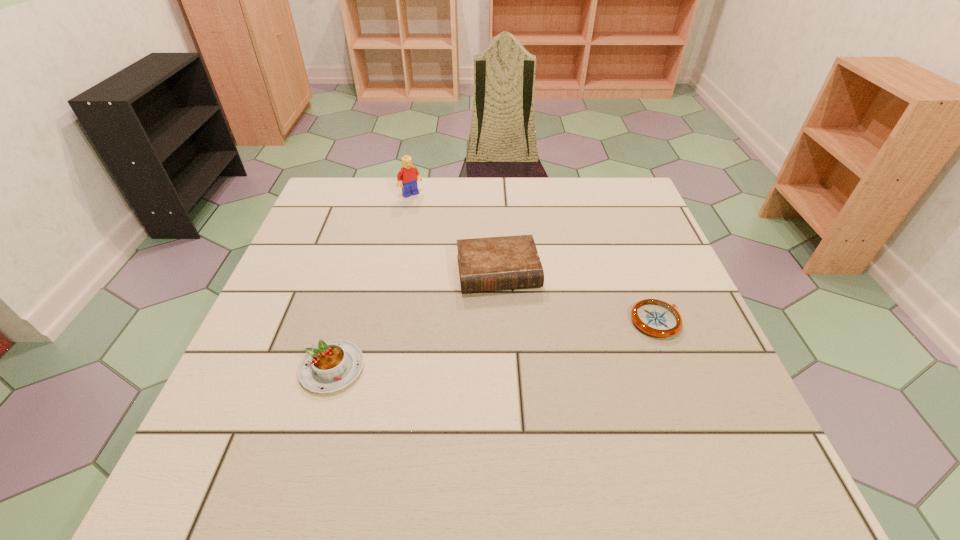
This screenshot has height=540, width=960. What are the coordinates of `the nearest object` in the screenshot? It's located at (331, 366).

Locate an element on the screen. The height and width of the screenshot is (540, 960). the shortest object is located at coordinates (657, 318).

Find the location of a particular element. Image resolution: width=960 pixels, height=540 pixels. the rightmost object is located at coordinates (657, 318).

Identify the location of the tallest object. The height and width of the screenshot is (540, 960). (408, 175).

Locate an element on the screen. This screenshot has width=960, height=540. the farthest object is located at coordinates (408, 175).

You are a GUI agent. You are given a task and a screenshot of the screen. Output one action in this format:
    pyautogui.click(x=<x>, y=<y>)
    Task: Click on the third nearest object
    Image resolution: width=960 pixels, height=540 pixels.
    Given the screenshot: What is the action you would take?
    pyautogui.click(x=509, y=262)

Locate an element on the screen. diary is located at coordinates (509, 262).

Locate an element on the screen. This screenshot has height=540, width=960. vacant space situated on the back of the nearest object is located at coordinates (373, 227).

Locate an element on the screen. Image resolution: width=960 pixels, height=540 pixels. vacant region located on the front of the rightmost object is located at coordinates [x=675, y=368].

The image size is (960, 540). Identify the location of vacant space located on the face of the tallest object. (485, 275).